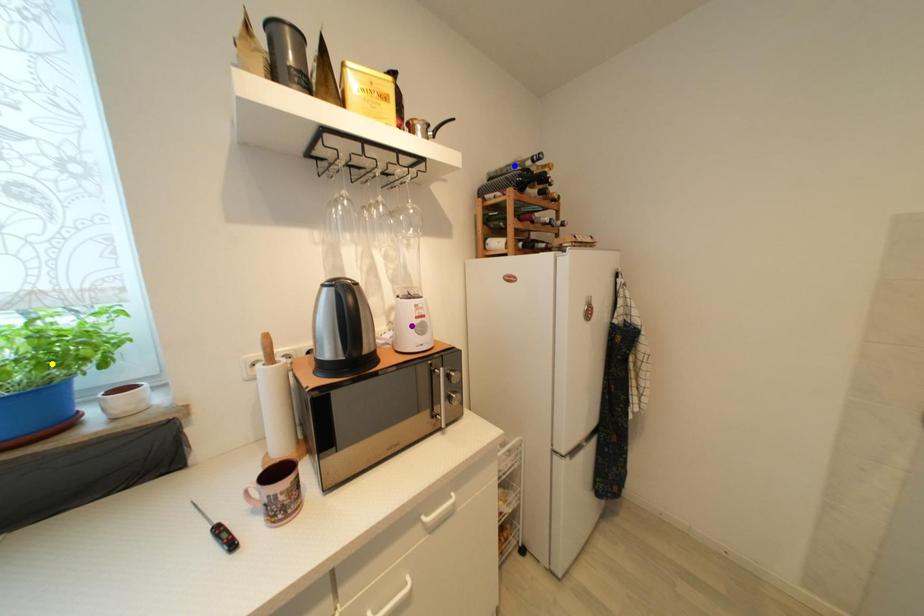
Order these from nearest to farthest:
purple point
blue point
yellow point

yellow point < purple point < blue point